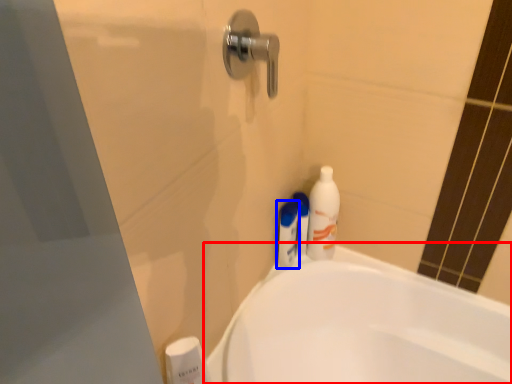
Question: Among these objects, which one is nearest to the camera, bathtub (highlighted by a red box) or toiletry (highlighted by a blue box)?

Choices:
 (A) bathtub
 (B) toiletry

Answer: (A)